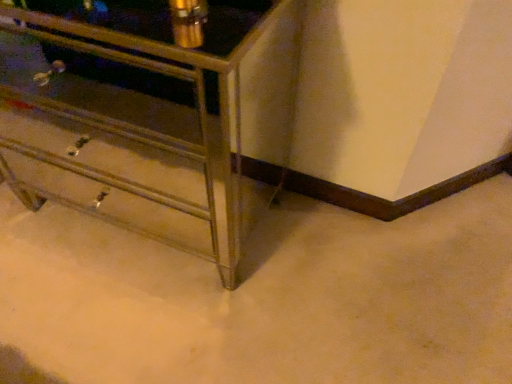
At what (x,y) coordinates should I click in order to perform the action: click on metallic mirrored chest of drawers at lower left. Please return your answer as a coordinate pair (x, y). The image size is (512, 384). Looking at the image, I should click on (143, 127).

Describe the element at coordinates (143, 127) in the screenshot. I see `metallic mirrored chest of drawers at lower left` at that location.

Measure the distance between metallic mirrored chest of drawers at lower left and camera.

metallic mirrored chest of drawers at lower left and camera are 26.87 inches apart.

Measure the distance between point [234,57] and camera.

Point [234,57] and camera are 1.21 meters apart from each other.

Identify the location of metallic mirrored chest of drawers at lower left. (143, 127).